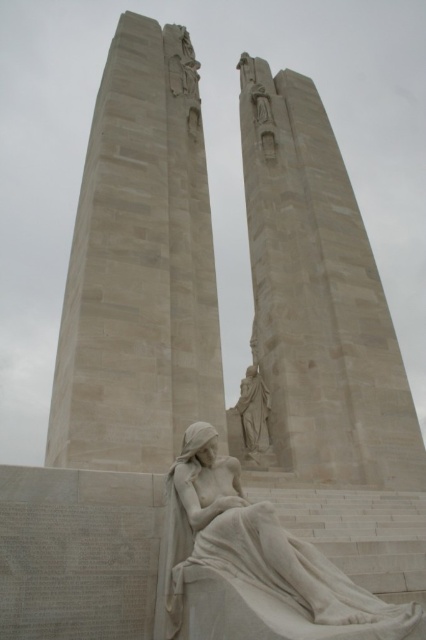
Question: Which of the following is the closest to the observer?

Choices:
 (A) light beige stone monument at center
 (B) light beige stone obelisk at center

Answer: (A)

Question: Which of the following is the closest to the observer?

Choices:
 (A) light beige stone obelisk at center
 (B) white marble statue at lower center

Answer: (B)

Question: Which object is farther from the camera taking this photo?

Choices:
 (A) light beige stone obelisk at center
 (B) light beige stone monument at center
 (C) white marble statue at lower center

Answer: (A)

Question: Does light beige stone obelisk at center lie behind white marble statue at center?

Choices:
 (A) yes
 (B) no

Answer: (B)

Question: Is light beige stone obelisk at center smaller than white marble statue at lower center?

Choices:
 (A) yes
 (B) no

Answer: (B)

Question: Is light beige stone obelisk at center closer to camera compared to white marble statue at center?

Choices:
 (A) yes
 (B) no

Answer: (A)